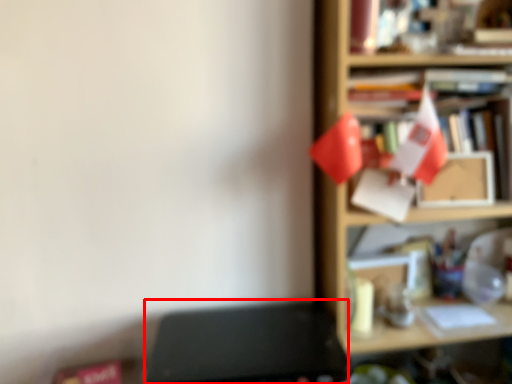
Question: Considering the relative positions of writing desk (annotated by the red box) and shelf in the image provided, where is writing desk (annotated by the red box) located with respect to the staircase?

Choices:
 (A) left
 (B) right

Answer: (A)